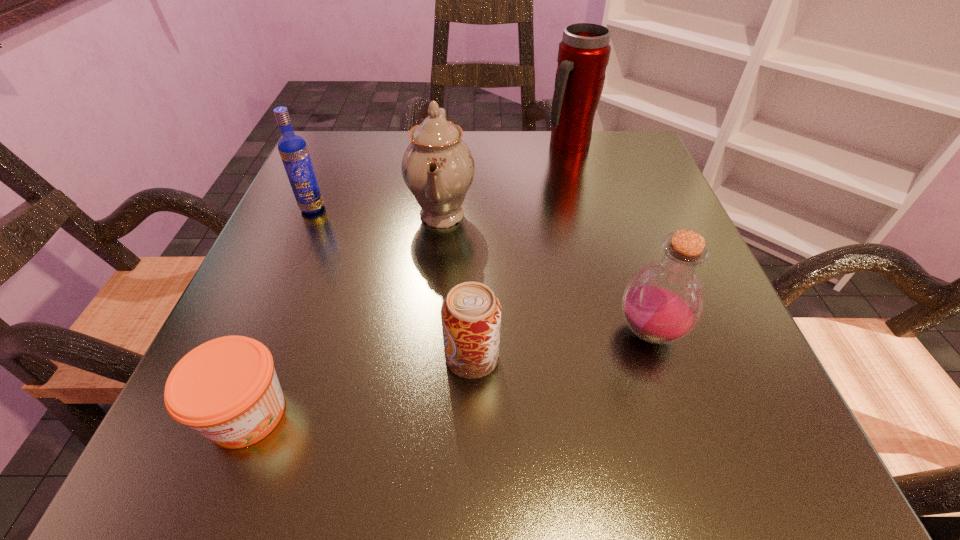
Where is `vacant space located 0.370m on the back of the beer can`? vacant space located 0.370m on the back of the beer can is located at coordinates (474, 186).

At what (x,y) coordinates should I click in order to perform the action: click on thermos bottle present at the far edge. Please return your answer as a coordinate pair (x, y). This screenshot has width=960, height=540. Looking at the image, I should click on (583, 55).

The width and height of the screenshot is (960, 540). What are the coordinates of `chinaware that is at the far edge` in the screenshot? It's located at (438, 168).

The image size is (960, 540). What are the coordinates of `object that is positioned at the near edge` in the screenshot? It's located at (226, 389).

You are a GUI agent. You are given a task and a screenshot of the screen. Output one action in this format:
    pyautogui.click(x=<x>, y=<y>)
    Task: Click on the vodka at the left edge
    This screenshot has height=540, width=960.
    Given the screenshot: What is the action you would take?
    (x=293, y=150)

At what (x,y) coordinates should I click in order to perform the action: click on jam present at the left edge. Please return your answer as a coordinate pair (x, y). The width and height of the screenshot is (960, 540). Looking at the image, I should click on (226, 389).

Where is `thermos bottle located at the right edge`? This screenshot has height=540, width=960. thermos bottle located at the right edge is located at coordinates (583, 55).

Where is `bottle located in the right edge section of the desktop`? This screenshot has width=960, height=540. bottle located in the right edge section of the desktop is located at coordinates 663,301.

This screenshot has width=960, height=540. What are the coordinates of `object that is at the near left corner` in the screenshot? It's located at (226, 389).

Where is `object located at the far right corner`? object located at the far right corner is located at coordinates (583, 55).